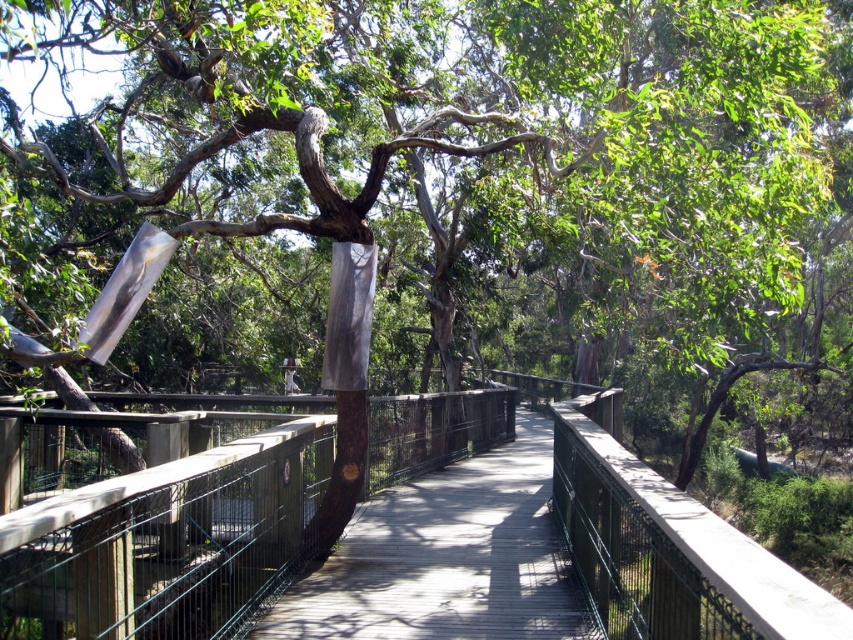
You are standing at the starting point of the boardwalk and want to reach the wooden bridge at center. According to the coordinates provided, in which direction should you walk to reach it?

The wooden bridge at center is located at coordinates point (167, 540). Since the x coordinate is higher than 0.5, you should walk towards the right direction to reach it.

You are a delivery person carrying a large box that is 1.5 meters wide. You need to cross the wooden bridge at center. Can you safely pass through it?

The wooden bridge at center has a width of 1.64 meters, which is wider than your box. Therefore, you can safely pass through it.

You are standing on the wooden boardwalk in the forest. You notice two points marked on the boardwalk. One is at coordinate point [538,380] and the other at point [474,636]. If you want to move towards the point that is closer to you, which coordinate should you walk towards?

You should walk towards point [538,380] because it is closer to you compared to point [474,636].